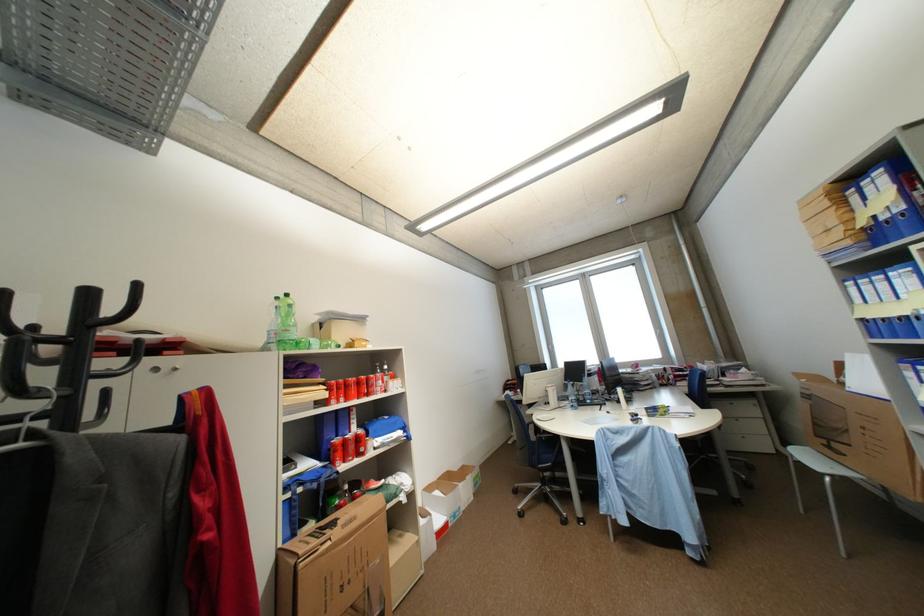
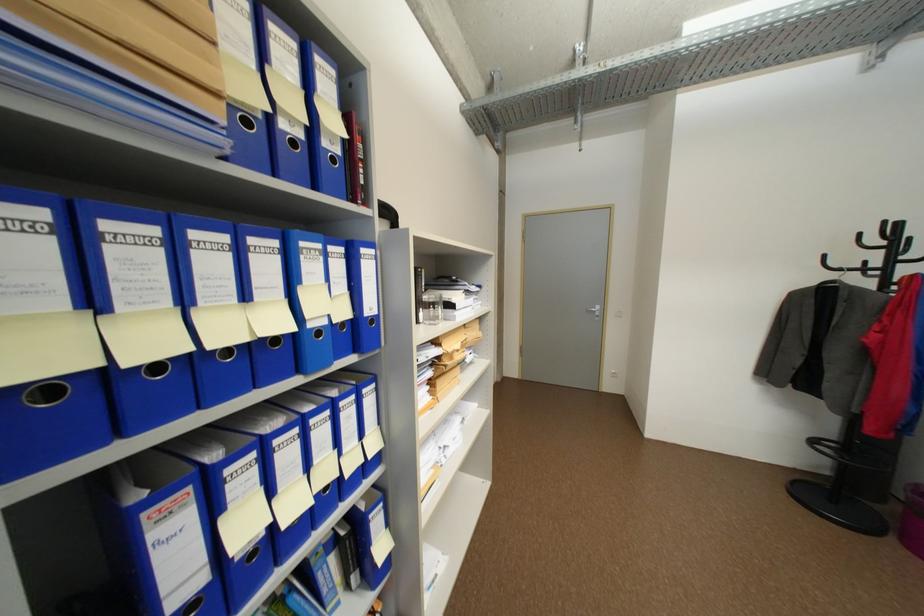
In the second image, find the point that corresponds to pixel 146 286 in the first image.

(893, 224)